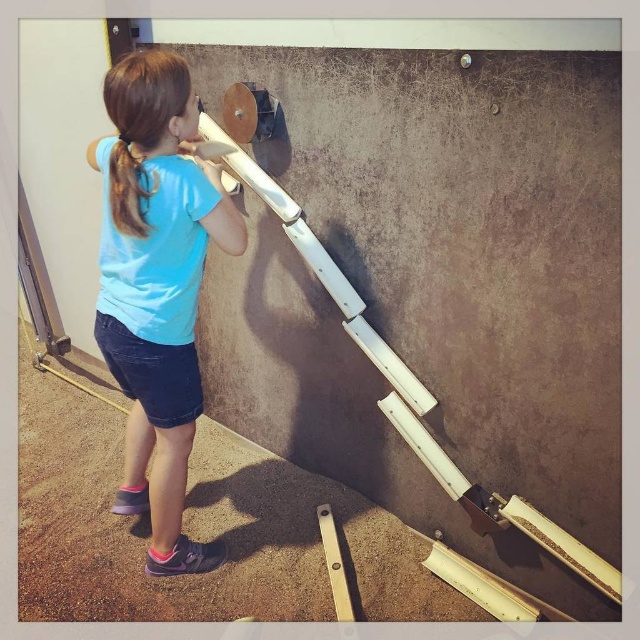
You are a photographer trying to capture the girl in the image. You want to position yourself so that the blue fabric shirt at center and the brown hair at upper left are both visible in your frame. Based on their positions, which side of the girl should you stand to ensure both elements are in view?

You should stand to the right of the girl because the blue fabric shirt at center is to the left of the brown hair at upper left, meaning the brown hair is on the right side relative to the shirt. Positioning yourself to the right allows both elements to be captured in the frame.

You are a photographer trying to capture the girl in the scene. You need to decide which part of the image to focus on to ensure both the blue fabric shirt at center and the brown hair at upper left are clearly visible. Which object should you prioritize focusing on and why?

You should prioritize focusing on the blue fabric shirt at center because it is larger than the brown hair at upper left, making it easier to capture details clearly.

You are a photographer positioned at the origin point of the image. The blue fabric shirt at center is represented by point (156,285). If you want to take a photo of the blue fabric shirt at center, which coordinate point should you focus on?

The blue fabric shirt at center is represented by point (156,285), so you should focus on coordinate point (156,285).